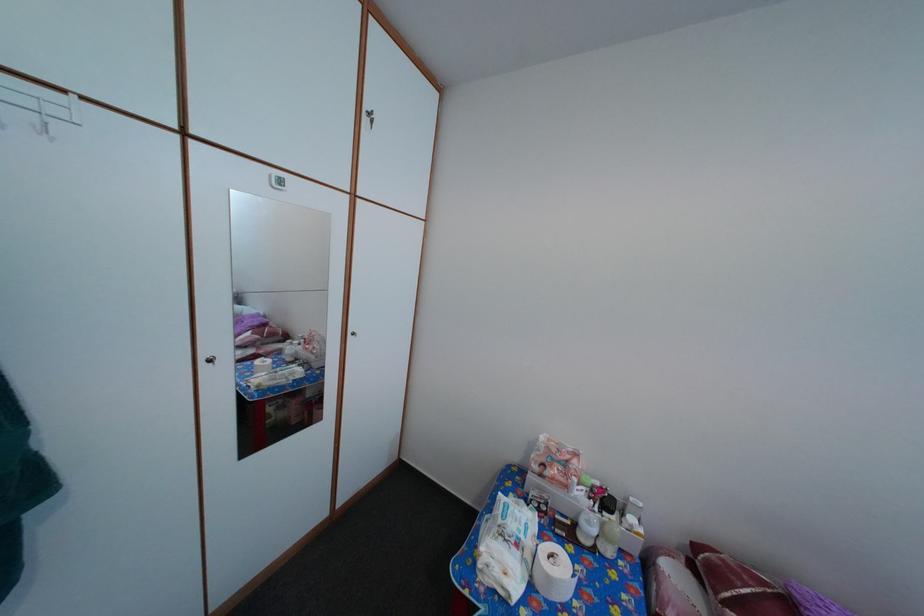
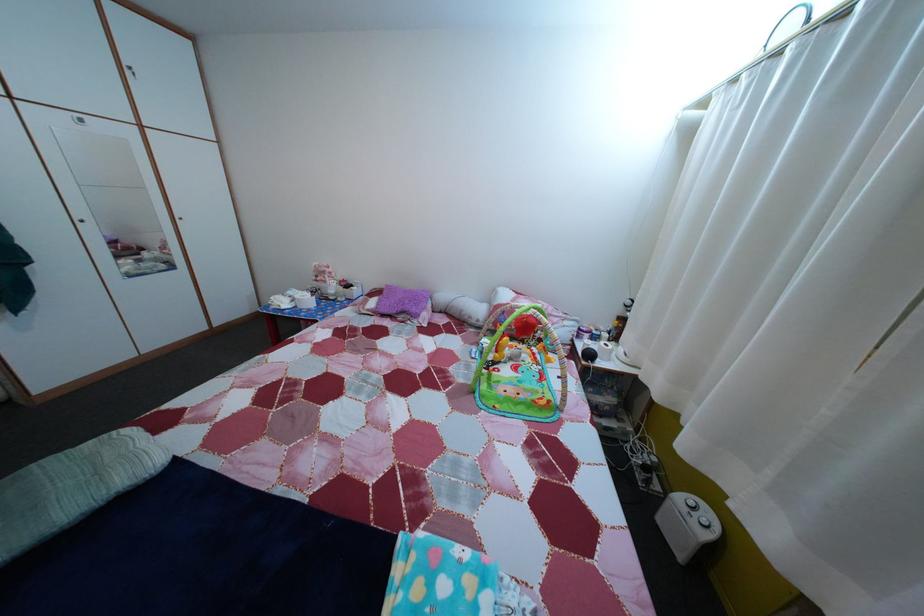
What movement of the cameraman would produce the second image?

The movement direction of the cameraman is right, backward.